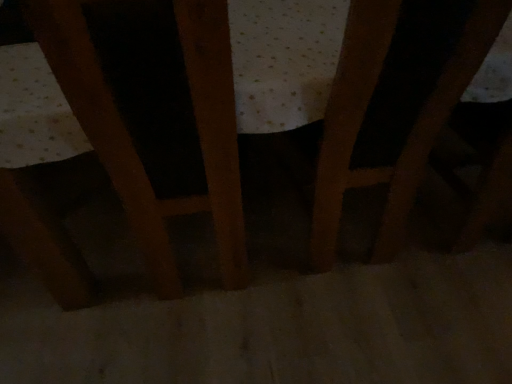
Identify the location of free region on the left part of wooden chair at center. This screenshot has height=384, width=512. (97, 268).